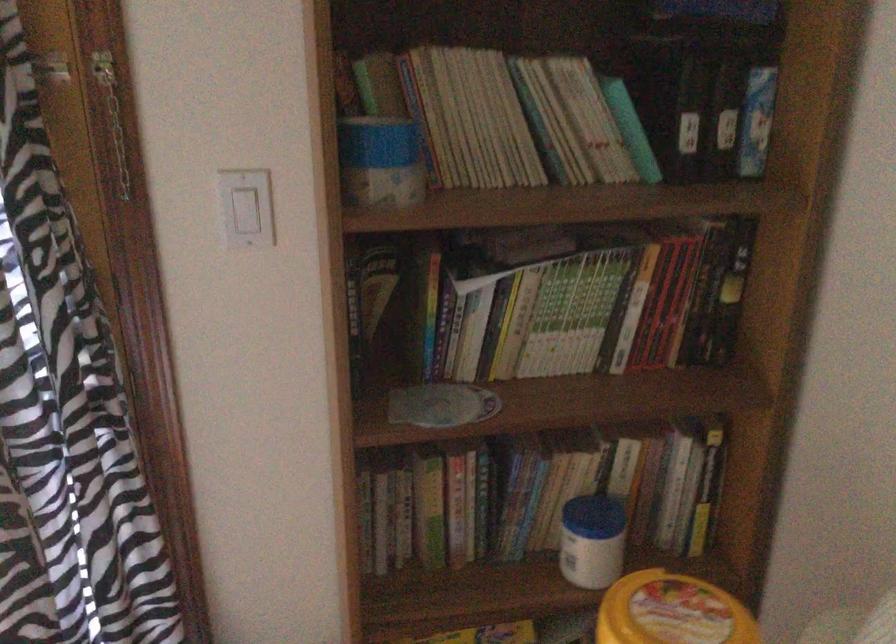
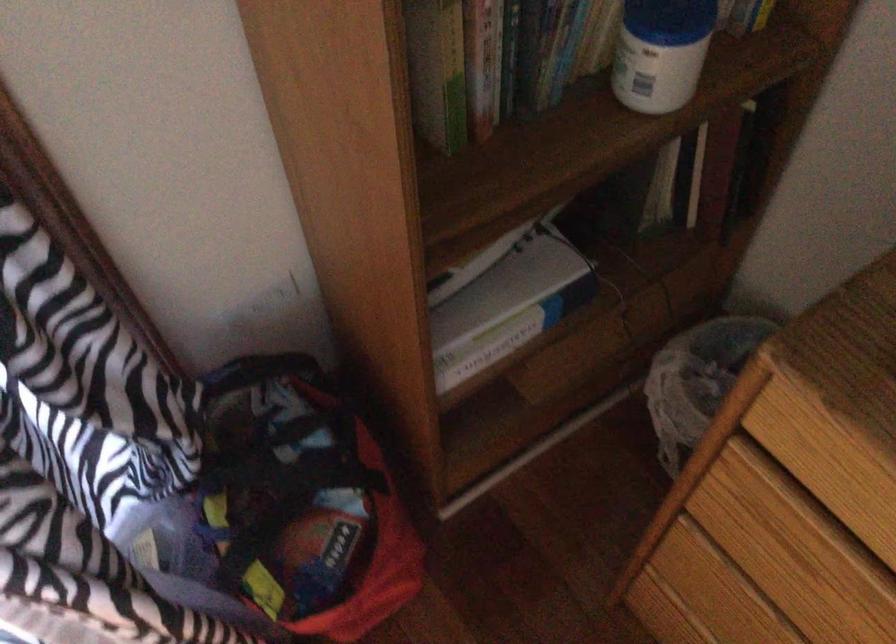
In the second image, find the point that corresponds to [581,536] in the first image.

(660, 53)